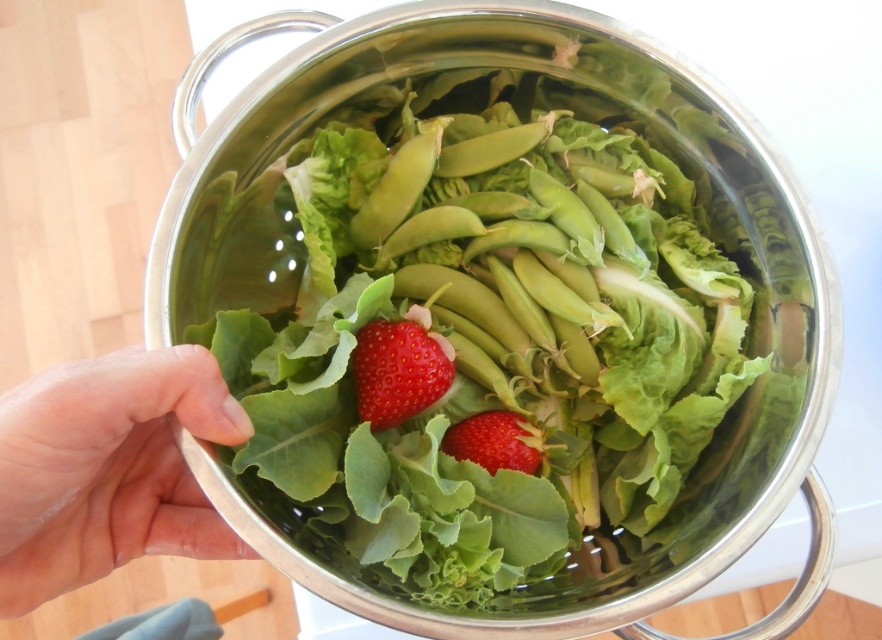
You are a chef preparing a salad and need to place the green matte salad at center on a plate. The plate is 15 centimeters in diameter. Can you fit the salad on the plate?

The green matte salad at center is 45.65 centimeters in diameter, which is larger than the plate. It won not fit. Please use a larger plate.

You are arranging fruits and vegetables in a colander. You have a pink flesh at center and a red matte strawberry at center. According to the image, which one is more to the left?

The pink flesh at center is positioned on the left side of red matte strawberry at center, so the pink flesh at center is more to the left.

You are holding a 40 cm long ruler and want to measure the distance from your eyes to the point at coordinates point [467,563]. Can you reach the point with your ruler?

The point [467,563] is 48.48 centimeters from viewer. Since the ruler is only 40 cm long, it cannot reach the point.